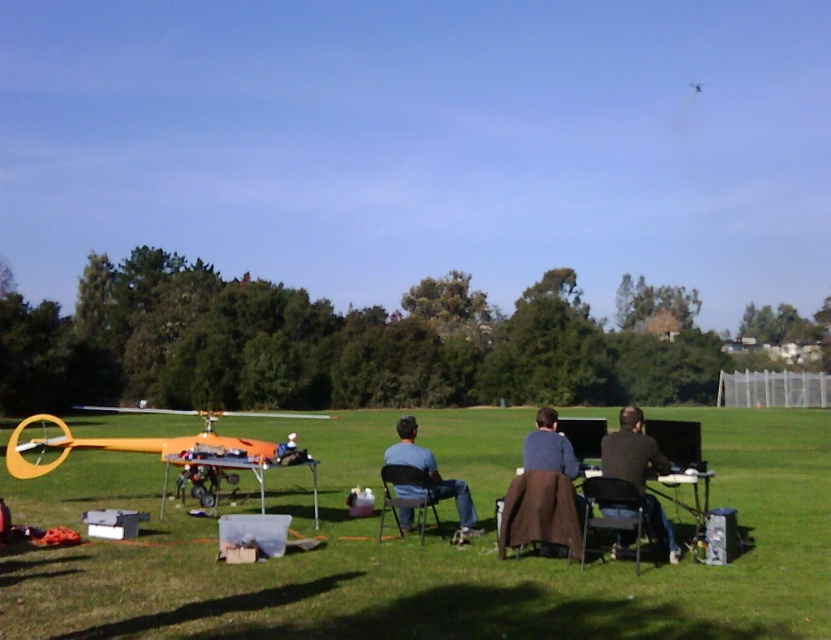
Question: Does green grass at center appear under black matte shirt at center?

Choices:
 (A) yes
 (B) no

Answer: (A)

Question: In this image, where is blue denim jeans at center located relative to brown fabric at center?

Choices:
 (A) right
 (B) left

Answer: (B)

Question: Which point is closer to the camera taking this photo?

Choices:
 (A) (251, 442)
 (B) (210, 608)
 (C) (583, 499)

Answer: (B)

Question: Which of the following is the closest to the observer?

Choices:
 (A) (529, 467)
 (B) (525, 541)
 (C) (214, 468)
 (D) (638, 465)

Answer: (D)

Question: Can you confirm if orange matte helicopter at lower left is positioned to the right of brown fabric chair at center?

Choices:
 (A) no
 (B) yes

Answer: (A)

Question: Which object appears farthest from the camera in this image?

Choices:
 (A) brown fabric at center
 (B) brown fabric chair at center
 (C) metallic silver chair at center

Answer: (C)